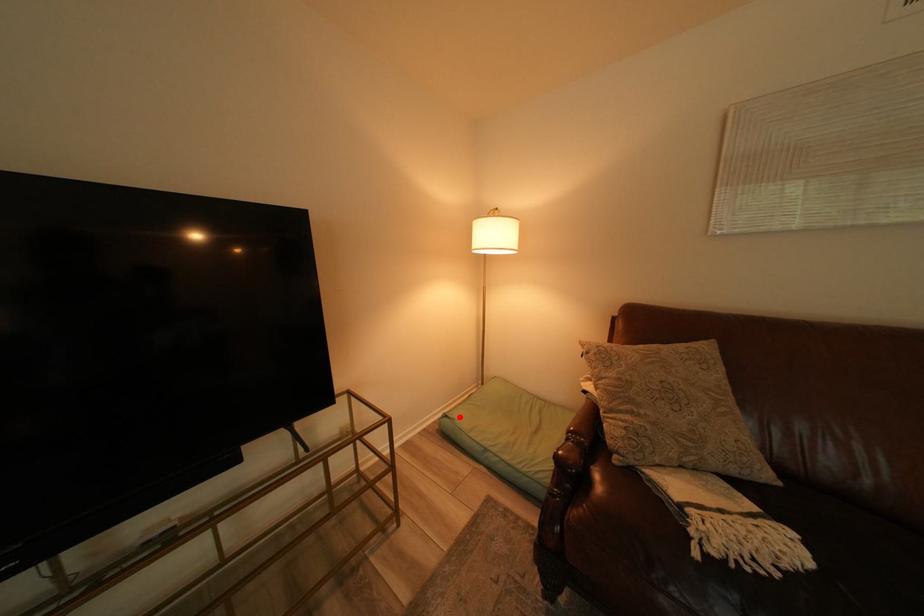
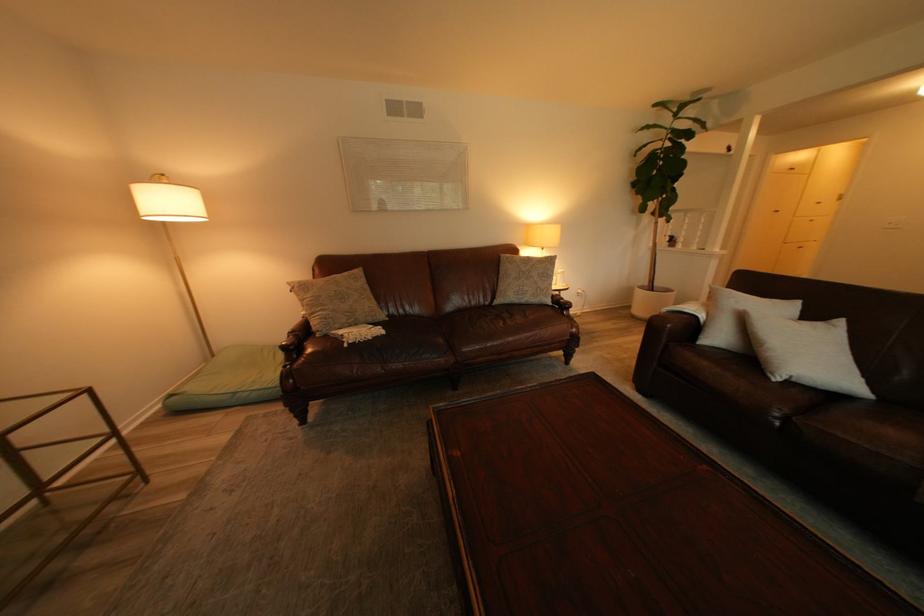
Question: I am providing you with two images of the same scene from different viewpoints. Image1 has a red point marked. In image2, the corresponding 3D location appears at what relative position? Reply with the corresponding letter.

Choices:
 (A) Closer
 (B) Farther

Answer: (A)